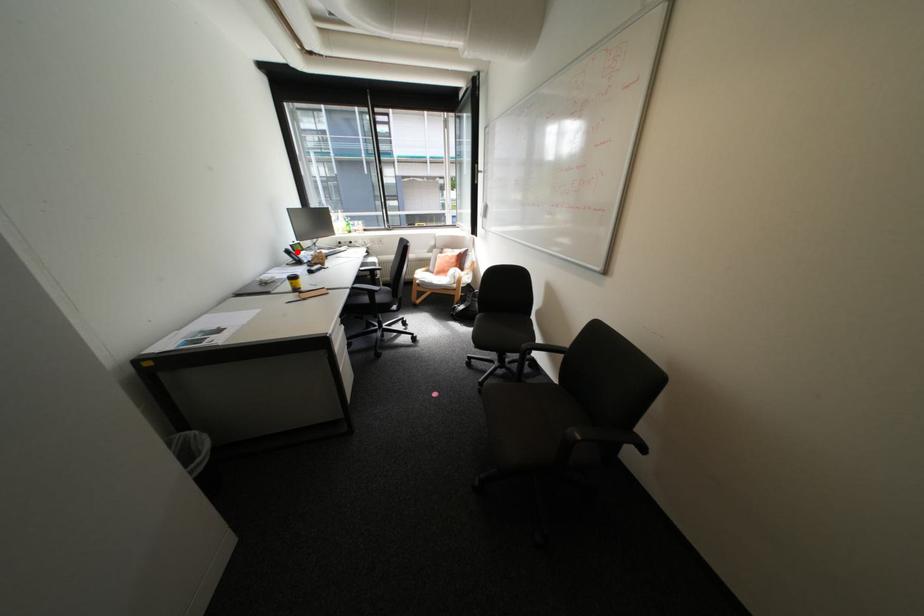
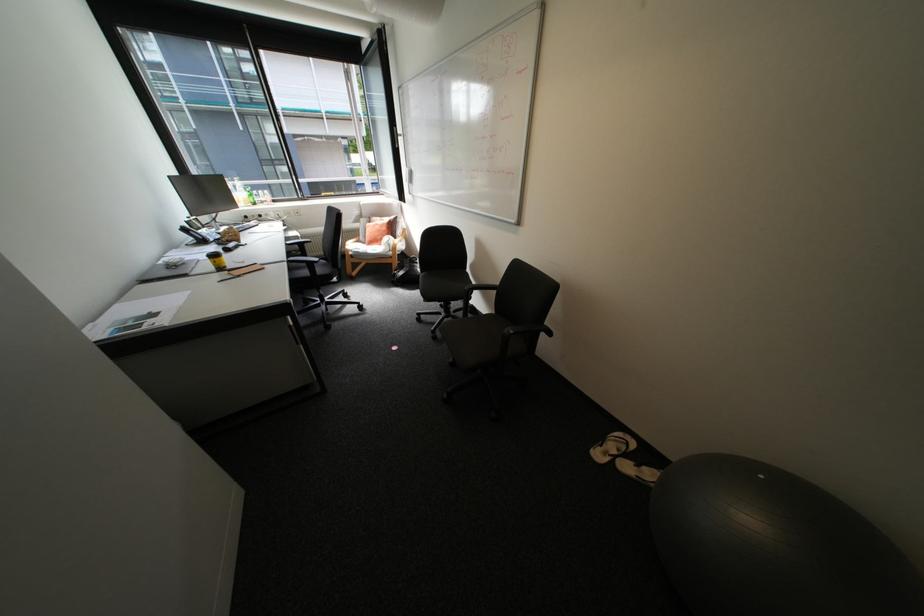
Find the pixel in the second image that matches the highlighted location in the first image.

(195, 230)